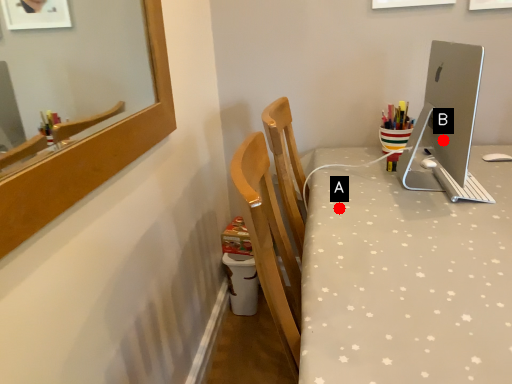
Question: Two points are circled on the image, labeled by A and B beside each circle. Which point is closer to the camera taking this photo?

Choices:
 (A) A is closer
 (B) B is closer

Answer: (A)